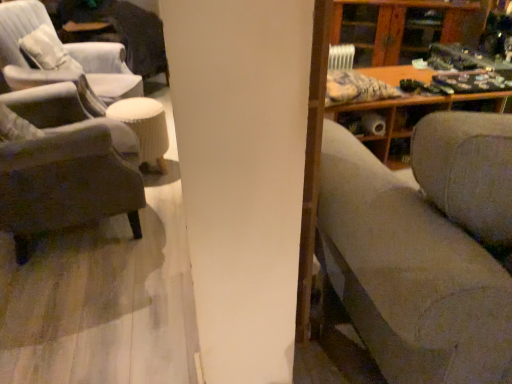
Question: From the image's perspective, would you say wooden cabinet at upper right is shown under textured gray couch at right?

Choices:
 (A) no
 (B) yes

Answer: (A)

Question: Is wooden cabinet at upper right taller than textured gray couch at right?

Choices:
 (A) no
 (B) yes

Answer: (A)

Question: Could you tell me if wooden cabinet at upper right is facing textured gray couch at right?

Choices:
 (A) yes
 (B) no

Answer: (A)

Question: Does wooden cabinet at upper right have a larger size compared to textured gray couch at right?

Choices:
 (A) yes
 (B) no

Answer: (B)

Question: Is wooden cabinet at upper right at the right side of textured gray couch at right?

Choices:
 (A) yes
 (B) no

Answer: (A)

Question: Is matte gray chair at left, which is the 1th chair in back-to-front order, situated inside white ribbed stool at center or outside?

Choices:
 (A) outside
 (B) inside

Answer: (A)

Question: From the image's perspective, relative to white ribbed stool at center, is matte gray chair at left, which ranks as the 2th chair in front-to-back order, above or below?

Choices:
 (A) below
 (B) above

Answer: (B)

Question: Is matte gray chair at left, which is the 1th chair in back-to-front order, taller or shorter than white ribbed stool at center?

Choices:
 (A) short
 (B) tall

Answer: (B)

Question: Is matte gray chair at left, which is the 1th chair in back-to-front order, to the left or to the right of white ribbed stool at center in the image?

Choices:
 (A) right
 (B) left

Answer: (B)

Question: From a real-world perspective, is wooden cabinet at upper right above or below matte gray chair at left, which ranks as the 2th chair in front-to-back order?

Choices:
 (A) below
 (B) above

Answer: (A)

Question: Based on their sizes in the image, would you say wooden cabinet at upper right is bigger or smaller than matte gray chair at left, which is the 1th chair in back-to-front order?

Choices:
 (A) small
 (B) big

Answer: (A)

Question: Relative to matte gray chair at left, which is the 1th chair in back-to-front order, is wooden cabinet at upper right in front or behind?

Choices:
 (A) front
 (B) behind

Answer: (B)

Question: From the image's perspective, is wooden cabinet at upper right positioned above or below matte gray chair at left, which is the 1th chair in back-to-front order?

Choices:
 (A) below
 (B) above

Answer: (B)

Question: Is point (489, 261) closer or farther from the camera than point (7, 38)?

Choices:
 (A) closer
 (B) farther

Answer: (A)

Question: Considering the relative positions of textured gray couch at right and matte gray chair at left, which ranks as the 2th chair in front-to-back order, in the image provided, is textured gray couch at right to the left or to the right of matte gray chair at left, which ranks as the 2th chair in front-to-back order,?

Choices:
 (A) right
 (B) left

Answer: (A)